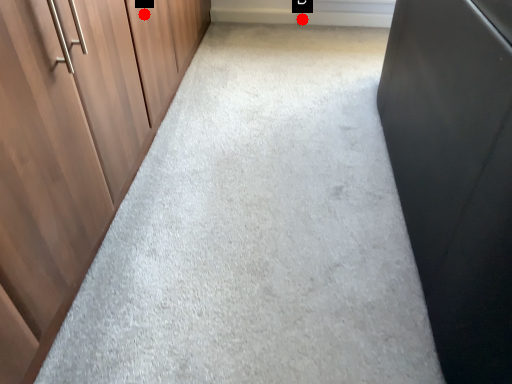
Question: Two points are circled on the image, labeled by A and B beside each circle. Which point is farther from the camera taking this photo?

Choices:
 (A) A is further
 (B) B is further

Answer: (B)